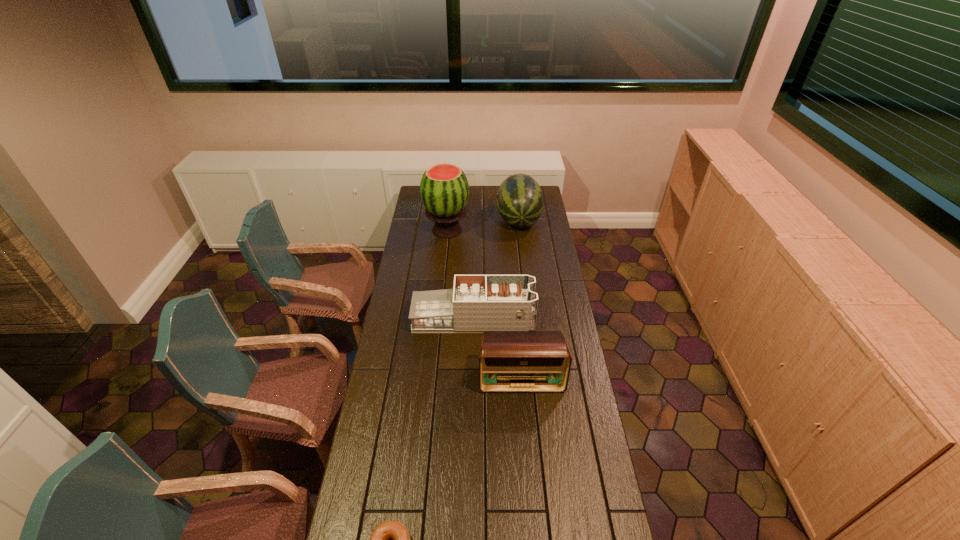
The image size is (960, 540). In order to click on the taller watermelon in this screenshot , I will do `click(444, 189)`.

I want to click on the left watermelon, so click(x=444, y=189).

Where is `the fourth shortest object`? The width and height of the screenshot is (960, 540). the fourth shortest object is located at coordinates (520, 200).

Image resolution: width=960 pixels, height=540 pixels. I want to click on the shorter watermelon, so click(x=520, y=200).

Locate an element on the screen. This screenshot has height=540, width=960. radio receiver is located at coordinates (510, 361).

The height and width of the screenshot is (540, 960). What are the coordinates of `dollhouse` in the screenshot? It's located at (x=476, y=303).

Locate an element on the screen. vacant space located on the front of the tallest object is located at coordinates [x=444, y=253].

Locate an element on the screen. The height and width of the screenshot is (540, 960). free point located on the front of the right watermelon is located at coordinates (522, 254).

This screenshot has height=540, width=960. I want to click on vacant space located 0.230m on the front-facing side of the radio receiver, so click(527, 448).

Locate an element on the screen. The image size is (960, 540). free point located at the entrance of the third nearest object is located at coordinates (567, 320).